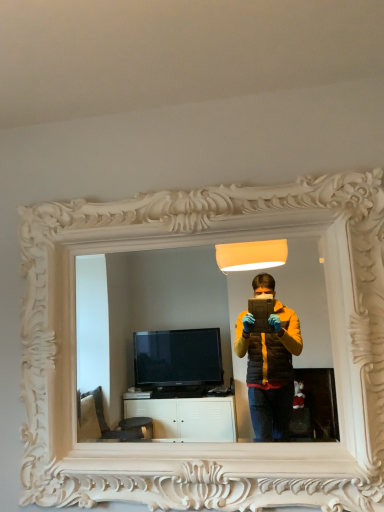
Identify the location of white carved mirror at center. The width and height of the screenshot is (384, 512). (200, 444).

This screenshot has width=384, height=512. What do you see at coordinates (200, 444) in the screenshot? I see `white carved mirror at center` at bounding box center [200, 444].

The image size is (384, 512). What are the coordinates of `white carved mirror at center` in the screenshot? It's located at (200, 444).